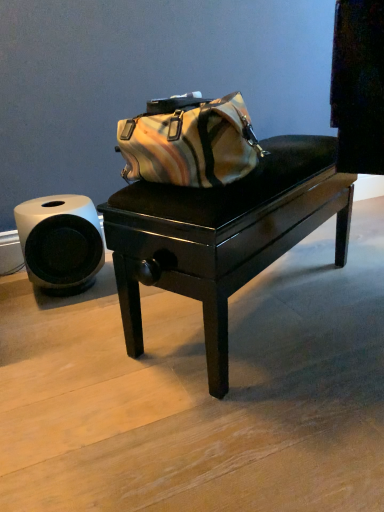
In order to click on vacant region in front of white matte toilet paper at left in this screenshot , I will do `click(56, 324)`.